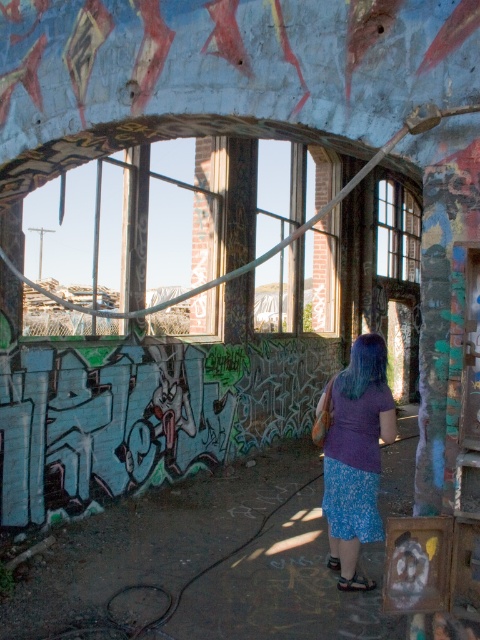
Question: Is purple fabric skirt at center below clear glass window at center?

Choices:
 (A) yes
 (B) no

Answer: (A)

Question: Does purple fabric skirt at center appear under clear glass window at center?

Choices:
 (A) yes
 (B) no

Answer: (A)

Question: Is purple fabric skirt at center smaller than clear glass window at center?

Choices:
 (A) no
 (B) yes

Answer: (B)